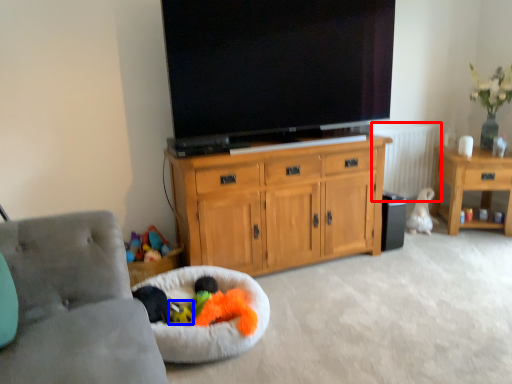
Question: Which point is closer to the camera, radiator (highlighted by a red box) or toy (highlighted by a blue box)?

Choices:
 (A) radiator
 (B) toy

Answer: (B)